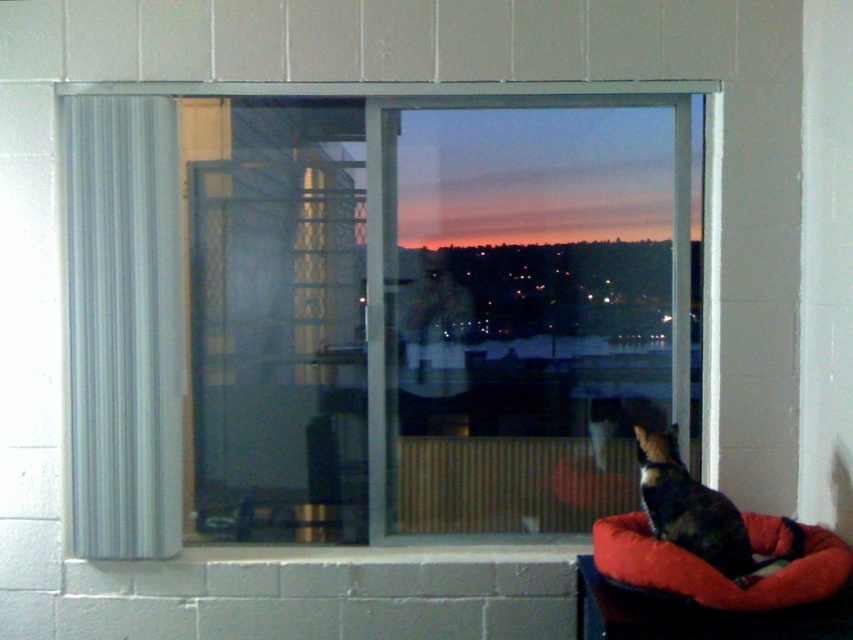
Question: Can you confirm if transparent glass window at center is positioned to the right of red plush dog bed at lower right?

Choices:
 (A) no
 (B) yes

Answer: (A)

Question: Is transparent glass window at center bigger than calico fur cat at lower right?

Choices:
 (A) no
 (B) yes

Answer: (B)

Question: Which is nearer to the transparent glass window at center?

Choices:
 (A) red plush dog bed at lower right
 (B) white fabric curtain at left

Answer: (B)

Question: Which point is closer to the camera?

Choices:
 (A) (590, 595)
 (B) (683, 499)
 (C) (146, 243)

Answer: (B)

Question: Which point is farther from the camera taking this photo?

Choices:
 (A) (538, 424)
 (B) (590, 628)
 (C) (666, 435)

Answer: (A)

Question: Can you confirm if transparent glass window at center is smaller than white fabric curtain at left?

Choices:
 (A) yes
 (B) no

Answer: (B)